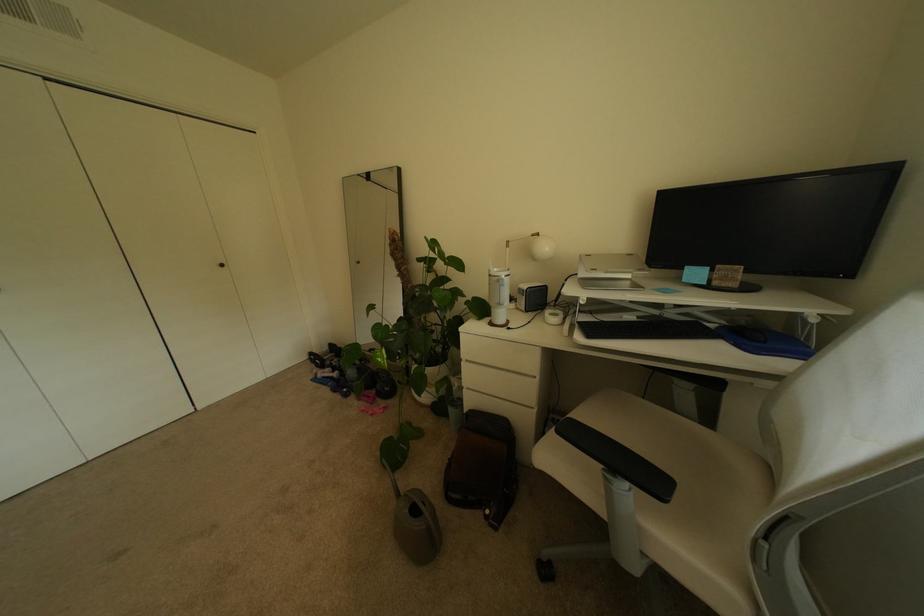
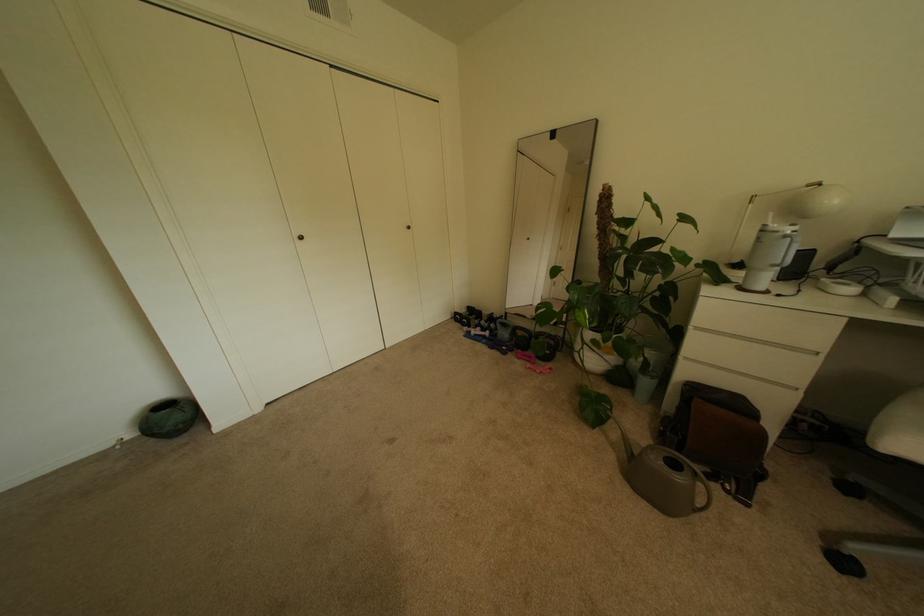
Locate, in the second image, the point that corresponds to the point at 386,400 in the first image.

(545, 362)